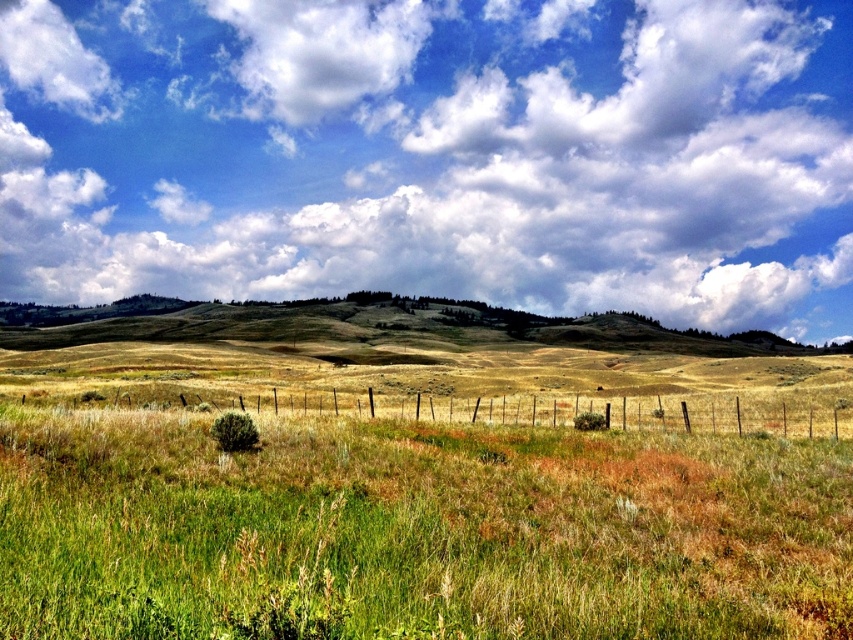
Question: Which point is farther to the camera?

Choices:
 (A) (819, 404)
 (B) (666, 500)
 (C) (569, 36)

Answer: (C)

Question: Which of the following is the closest to the observer?

Choices:
 (A) (326, 396)
 (B) (746, 252)

Answer: (A)

Question: Does white fluffy cloud at upper center have a greater width compared to green grassy field at center?

Choices:
 (A) yes
 (B) no

Answer: (A)

Question: Which point appears closest to the camera in this image?

Choices:
 (A) (517, 403)
 (B) (618, 483)
 (C) (645, 108)

Answer: (B)

Question: Can you confirm if white fluffy cloud at upper center is smaller than green grassy field at center?

Choices:
 (A) yes
 (B) no

Answer: (B)

Question: Is green grassy field at center positioned in front of brown wire fence at center?

Choices:
 (A) no
 (B) yes

Answer: (B)